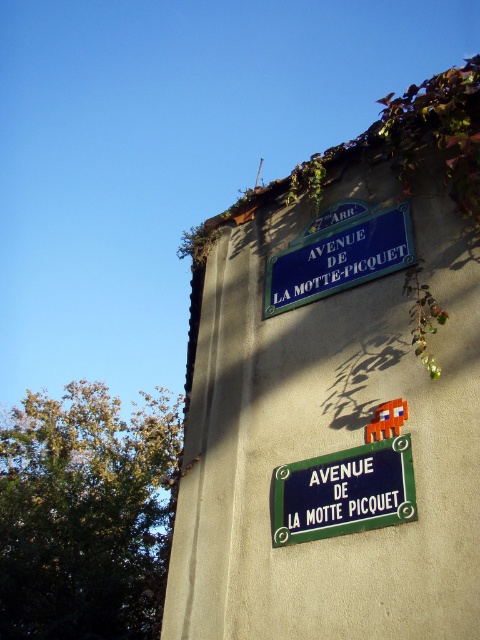
Who is positioned more to the right, green leafy ivy at upper right or green metal street sign at upper center?

Positioned to the right is green metal street sign at upper center.

Does point (91, 576) come behind point (359, 470)?

Yes, point (91, 576) is farther from viewer.

Locate an element on the screen. green leafy ivy at upper right is located at coordinates (85, 515).

Between point (82, 577) and point (268, 310), which one is positioned in front?

Point (268, 310) is more forward.

Does green leafy ivy at upper right appear over blue plastic street sign at upper center?

No.

Locate an element on the screen. green leafy ivy at upper right is located at coordinates pyautogui.click(x=85, y=515).

Does green metal street sign at upper center lie behind blue plastic street sign at upper center?

No, it is not.

Can you confirm if green metal street sign at upper center is bigger than blue plastic street sign at upper center?

Actually, green metal street sign at upper center might be smaller than blue plastic street sign at upper center.

The height and width of the screenshot is (640, 480). In order to click on green metal street sign at upper center in this screenshot , I will do `click(344, 492)`.

Locate an element on the screen. green metal street sign at upper center is located at coordinates (344, 492).